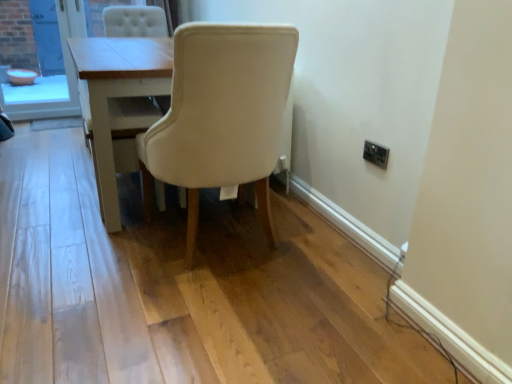
Question: Is light wood table at center in front of or behind black plastic electric outlet at upper right in the image?

Choices:
 (A) front
 (B) behind

Answer: (B)

Question: Is light wood table at center wider or thinner than black plastic electric outlet at upper right?

Choices:
 (A) wide
 (B) thin

Answer: (A)

Question: Considering the real-world distances, which object is closest to the orange plastic bowl at left?

Choices:
 (A) black plastic electric outlet at upper right
 (B) beige fabric chair at center
 (C) light wood table at center

Answer: (C)

Question: Which object is positioned closest to the light wood table at center?

Choices:
 (A) beige fabric chair at center
 (B) black plastic electric outlet at upper right
 (C) orange plastic bowl at left

Answer: (A)